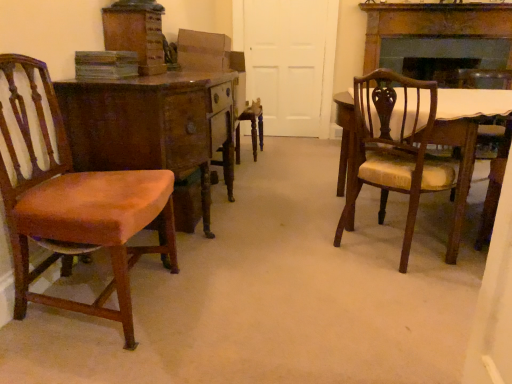
The height and width of the screenshot is (384, 512). In order to click on free point behind matte brown chair at right, positioned as the first chair in right-to-left order in this screenshot , I will do `click(364, 226)`.